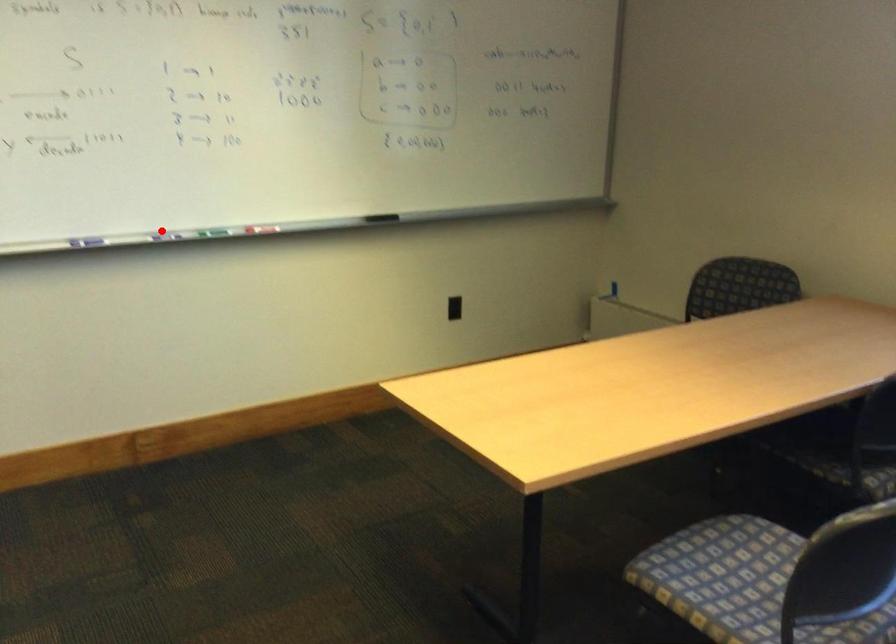
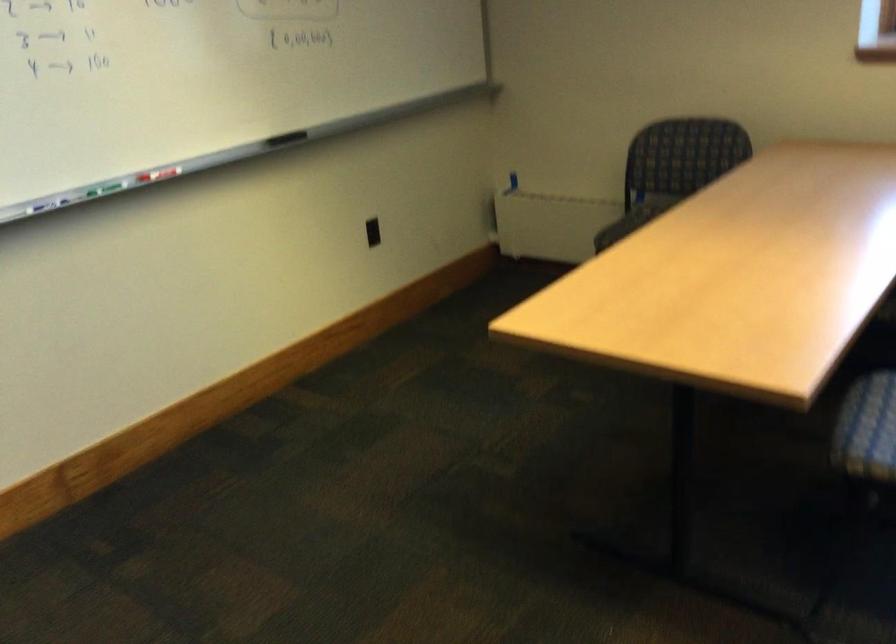
Question: I am providing you with two images of the same scene from different viewpoints. In image1, a red point is highlighted. Considering the same 3D point in image2, which of the following is correct?

Choices:
 (A) It is closer
 (B) It is farther

Answer: (A)